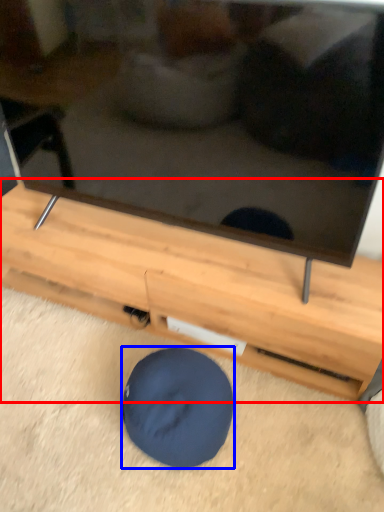
Question: Which object is further to the camera taking this photo, furniture (highlighted by a red box) or dog bed (highlighted by a blue box)?

Choices:
 (A) furniture
 (B) dog bed

Answer: (A)